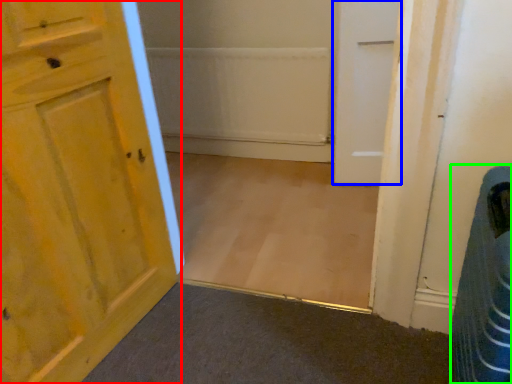
Question: Considering the real-world distances, which object is farthest from door (highlighted by a red box)? door (highlighted by a blue box) or laundry basket (highlighted by a green box)?

Choices:
 (A) door
 (B) laundry basket

Answer: (A)